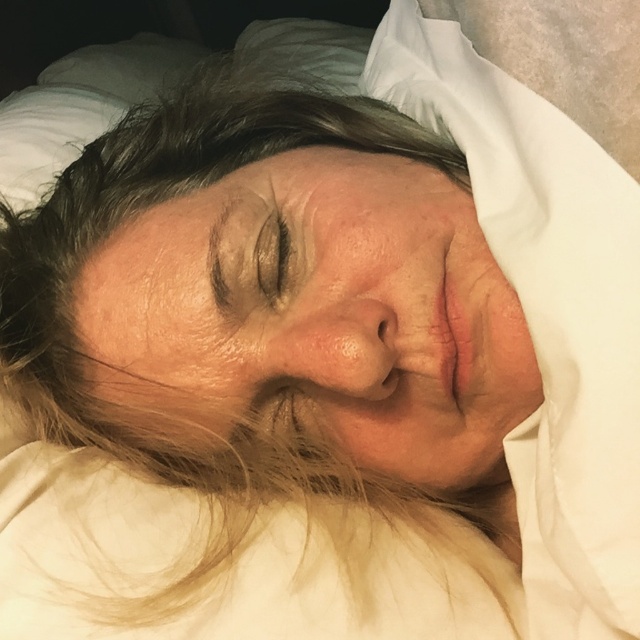
You are a healthcare professional examining a patient lying down. You notice the dry skin at center. Where exactly is the dry skin located in terms of coordinates on the patient?

The dry skin at center is located at the coordinates point (317, 317).

You are a skincare specialist examining the facial features of the person in the image. You notice the dry skin at center and the brown matte eye at center. Which of these two features has a greater width?

The dry skin at center has a greater width than the brown matte eye at center, as stated in the description that dry skin at center surpasses brown matte eye at center in width.

You are a healthcare professional checking the patient lying down in the image. You notice the dry skin at center and the brown matte eye at center. Which of these is closer to the observer?

The dry skin at center is in front of the brown matte eye at center, so the dry skin at center is closer to the observer.